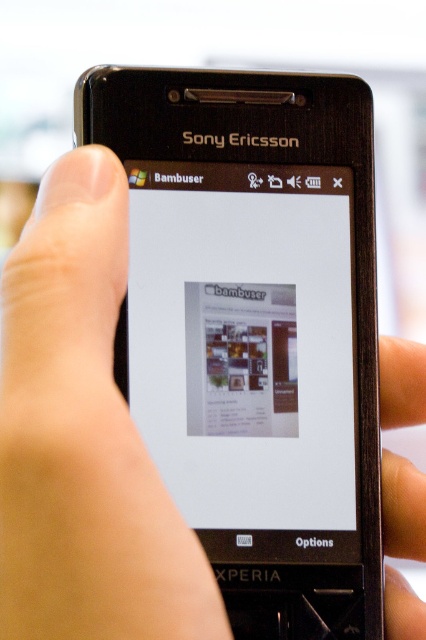
From the picture: You are holding the Sony Ericsson Xperia smartphone and want to touch the point at coordinates point (198, 445) on the screen. If your finger is 0.5 inches wide, will it cover the point completely?

The point at (198, 445) is 16.88 inches away from the viewer. Since your finger is only 0.5 inches wide, it will cover the point completely when touched.

You are a designer who needs to ensure that the touch target on the screen is large enough for users to interact with comfortably. The recommended minimum touch target size is 44 pixels. Given that the distance between the white glossy screen at center and the skinny metallic finger at upper right is 3.29 inches, can you determine if the touch target on the screen is large enough?

The distance between the white glossy screen at center and the skinny metallic finger at upper right is 3.29 inches. Since the touch target must be at least 44 pixels, but the provided information does not specify the screen resolution or pixel density, it is impossible to determine if the touch target meets the minimum size requirement based solely on the distance in inches.

Consider the image. You are holding a Sony Ericsson Xperia phone and want to start a live stream using the Bambuser app. The app interface shows the white glossy screen at center and a skinny metallic finger at upper right. Which object on the phone is larger?

The white glossy screen at center is bigger than the skinny metallic finger at upper right, so the white glossy screen at center is larger.